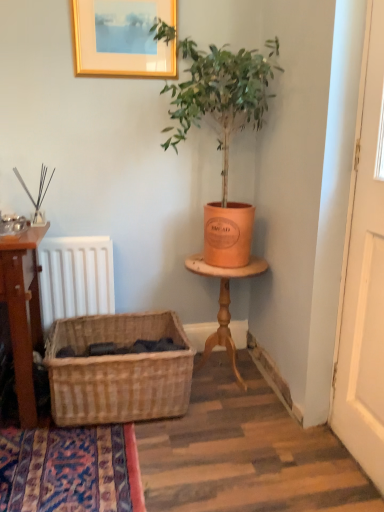
I want to click on vacant point to the right of woven natural basket at lower left, so click(x=240, y=422).